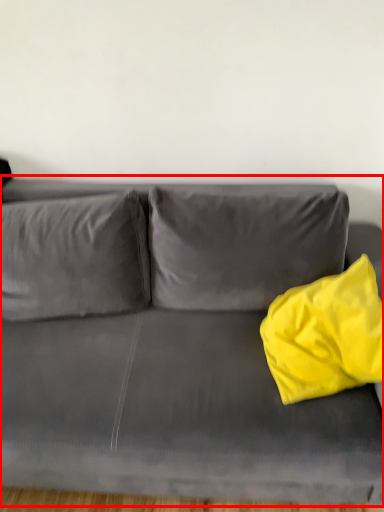
Question: From the image's perspective, considering the relative positions of studio couch (annotated by the red box) and throw pillow in the image provided, where is studio couch (annotated by the red box) located with respect to the staircase?

Choices:
 (A) below
 (B) above

Answer: (A)